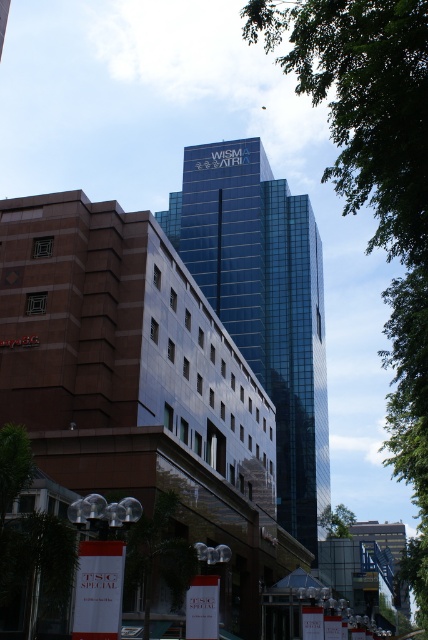
You are a city planner assessing the urban space. The green leafy tree at upper right and the shiny glass tower at center are both part of the cityscape. Based on their widths, which one would require more horizontal space for maintenance equipment to maneuver around?

The shiny glass tower at center requires more horizontal space for maintenance equipment to maneuver around because it has a greater width than the green leafy tree at upper right.

You are an urban planner reviewing this city layout. You notice two green leafy trees in the scene. Which tree, the green leafy tree at upper right or the green leafy tree at center, is closer to the viewer?

The green leafy tree at upper right is closer to the viewer because it is in front of the green leafy tree at center.